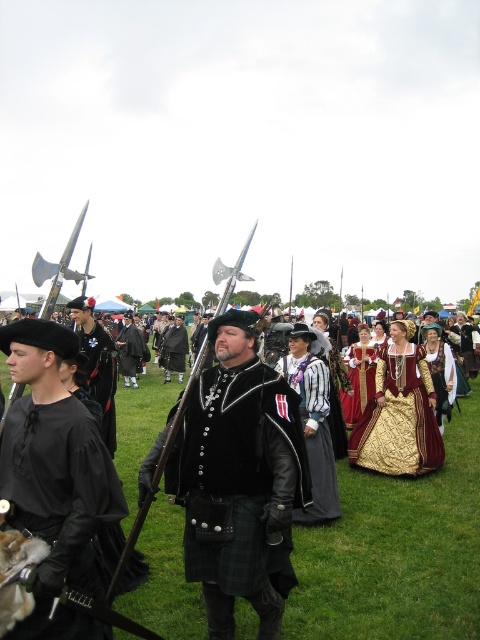
Question: Can you confirm if velvet black vest at center is positioned to the right of black leather jacket at center?

Choices:
 (A) no
 (B) yes

Answer: (B)

Question: Which point is farther to the camera?

Choices:
 (A) velvet black vest at center
 (B) gold brocade dress at center
 (C) black velvet hat at center
 (D) black matte shirt at left

Answer: (B)

Question: Among these points, which one is nearest to the camera?

Choices:
 (A) (183, 339)
 (B) (437, 401)
 (C) (182, 456)

Answer: (C)

Question: In this image, where is black matte shirt at left located relative to black velvet hat at center?

Choices:
 (A) right
 (B) left

Answer: (A)

Question: Does black velvet hat at center appear on the left side of black leather jacket at center?

Choices:
 (A) no
 (B) yes

Answer: (A)

Question: Among these objects, which one is nearest to the camera?

Choices:
 (A) gold brocade dress at center
 (B) black leather jacket at center
 (C) black velvet hat at center
 (D) striped fabric dress at center

Answer: (D)